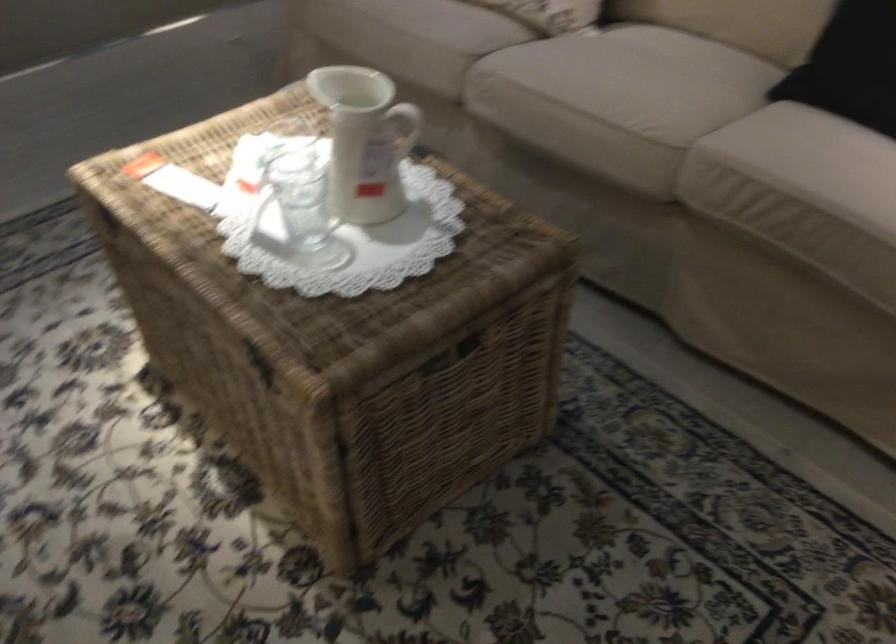
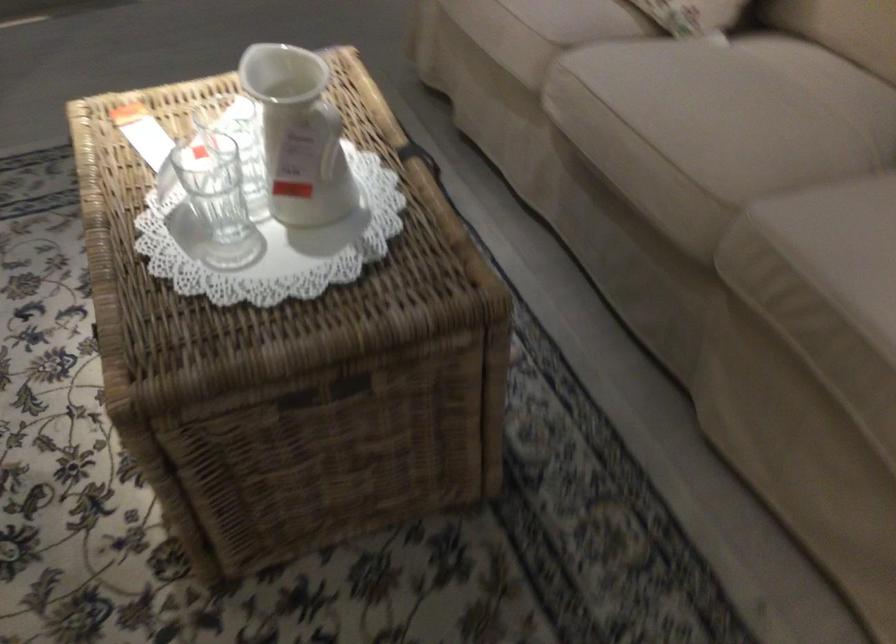
Question: How did the camera likely rotate?

Choices:
 (A) Left
 (B) Right
 (C) Up
 (D) Down

Answer: (A)